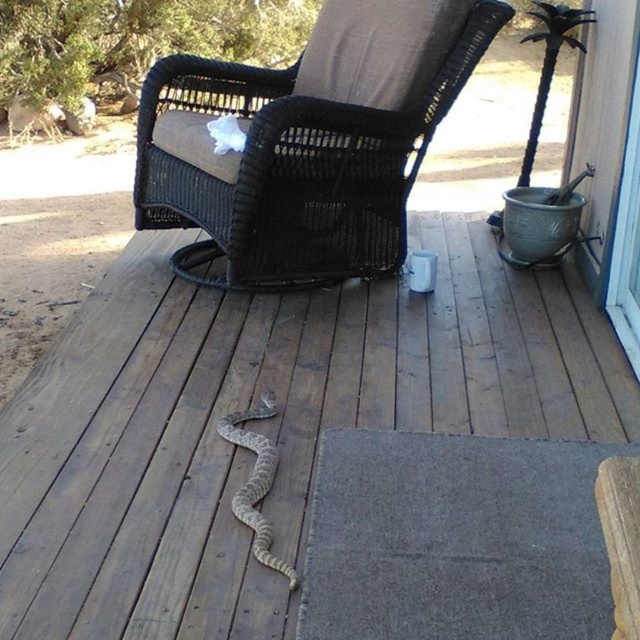
Based on the photo, who is lower down, black wicker chair at center or transparent glass screen door at right?

black wicker chair at center is below.

Which of these two, black wicker chair at center or transparent glass screen door at right, stands taller?

With more height is transparent glass screen door at right.

I want to click on black wicker chair at center, so click(307, 141).

Is transparent glass screen door at right to the right of brown scaly snake at center from the viewer's perspective?

Correct, you'll find transparent glass screen door at right to the right of brown scaly snake at center.

Which is in front, point (620, 3) or point (268, 492)?

Point (268, 492) is in front.

Does point (636, 38) lie behind point (220, 432)?

Yes, it is behind point (220, 432).

I want to click on transparent glass screen door at right, so click(602, 124).

Is brown textured snake at center to the left of transparent glass screen door at upper right from the viewer's perspective?

Correct, you'll find brown textured snake at center to the left of transparent glass screen door at upper right.

Who is more distant from viewer, (256,605) or (637,12)?

The point (637,12) is behind.

The image size is (640, 640). Identify the location of brown textured snake at center. (262, 422).